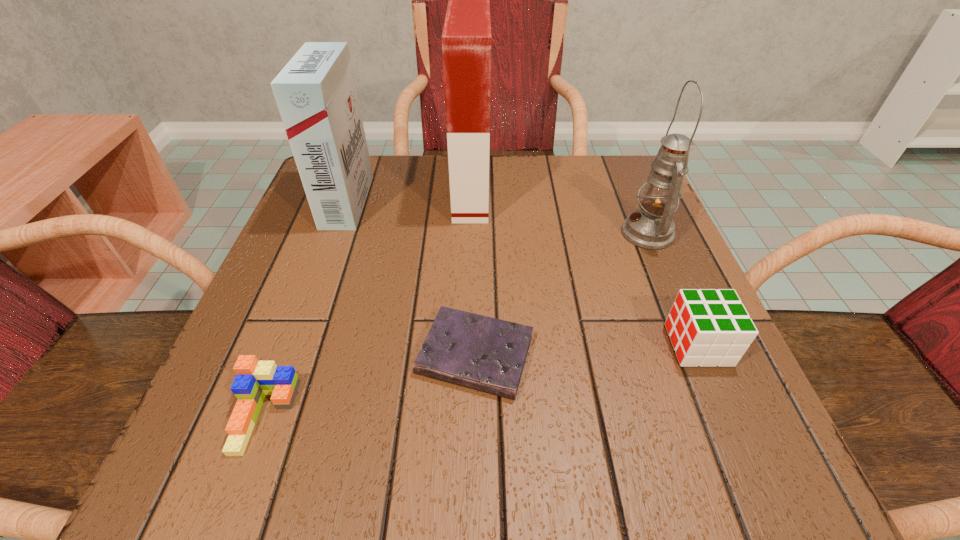
Where is `the taller cigarette case`? Image resolution: width=960 pixels, height=540 pixels. the taller cigarette case is located at coordinates (466, 38).

In order to click on oil lamp in this screenshot , I will do `click(651, 227)`.

Image resolution: width=960 pixels, height=540 pixels. Identify the location of the shorter cigarette case. (316, 95).

Where is `the third shortest object`? The width and height of the screenshot is (960, 540). the third shortest object is located at coordinates (707, 327).

Locate an element on the screen. This screenshot has height=540, width=960. Lego is located at coordinates (255, 379).

At what (x,y) coordinates should I click in order to perform the action: click on the shortest object. Please return your answer as a coordinate pair (x, y). Image resolution: width=960 pixels, height=540 pixels. Looking at the image, I should click on (482, 353).

The width and height of the screenshot is (960, 540). I want to click on blank space located on the front-facing side of the taller cigarette case, so click(x=565, y=192).

In order to click on blank area located 0.100m on the back of the oil lamp in this screenshot , I will do click(628, 186).

Locate an element on the screen. This screenshot has width=960, height=540. vacant space located on the right of the left cigarette case is located at coordinates (512, 202).

Image resolution: width=960 pixels, height=540 pixels. What are the coordinates of `free spot located on the red face of the fourth tallest object` in the screenshot? It's located at pos(535,345).